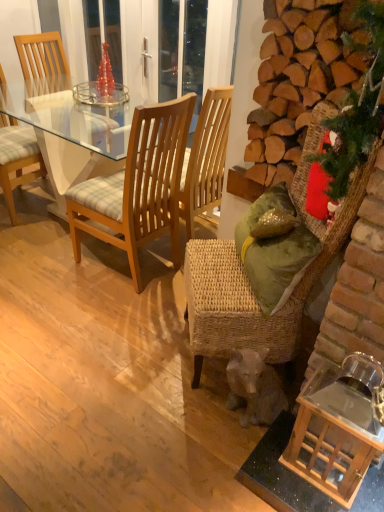
At what (x,y) coordinates should I click in order to perform the action: click on blank area to the left of woven wicker chair at right, which is counted as the 4th chair, starting from the left. Please return your answer as a coordinate pair (x, y). Looking at the image, I should click on (130, 354).